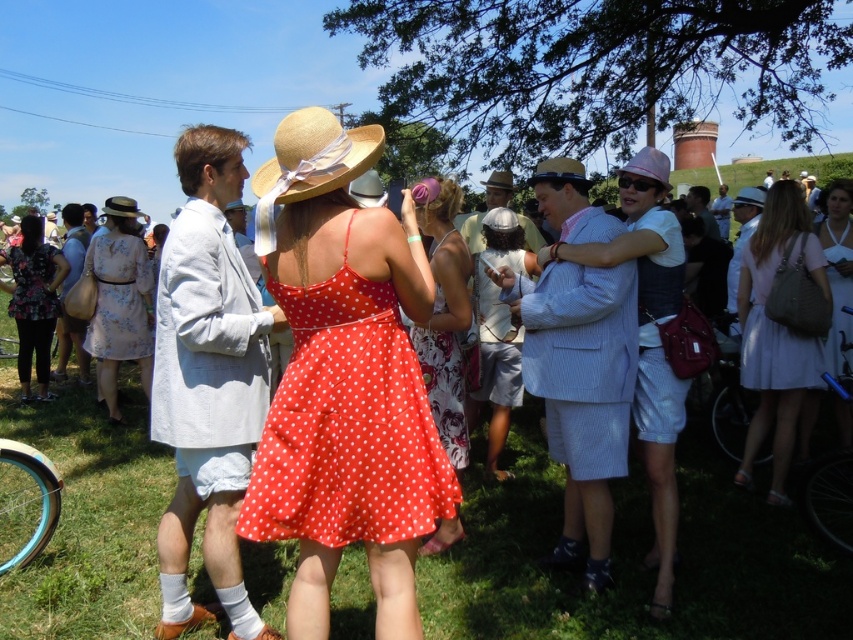
Can you confirm if matte pink dress at right is wider than straw hat at center?

In fact, matte pink dress at right might be narrower than straw hat at center.

Who is positioned more to the left, matte pink dress at right or straw hat at center?

From the viewer's perspective, straw hat at center appears more on the left side.

Which is behind, point (741, 371) or point (286, 129)?

Positioned behind is point (741, 371).

This screenshot has height=640, width=853. What are the coordinates of `matte pink dress at right` in the screenshot? It's located at (773, 336).

Can you confirm if matte white shorts at center is shorter than straw hat at center?

No, matte white shorts at center is not shorter than straw hat at center.

Between point (662, 378) and point (318, 131), which one is positioned behind?

The point (662, 378) is more distant.

Locate an element on the screen. matte white shorts at center is located at coordinates (648, 340).

Is point (1, 252) in front of point (293, 120)?

No, (1, 252) is behind (293, 120).

Which of these two, floral fabric dress at lower left or straw hat at center, stands shorter?

straw hat at center

Does point (22, 273) come in front of point (328, 112)?

No, it is behind (328, 112).

At what (x,y) coordinates should I click in order to perform the action: click on floral fabric dress at lower left. Please return your answer as a coordinate pair (x, y). Looking at the image, I should click on (33, 301).